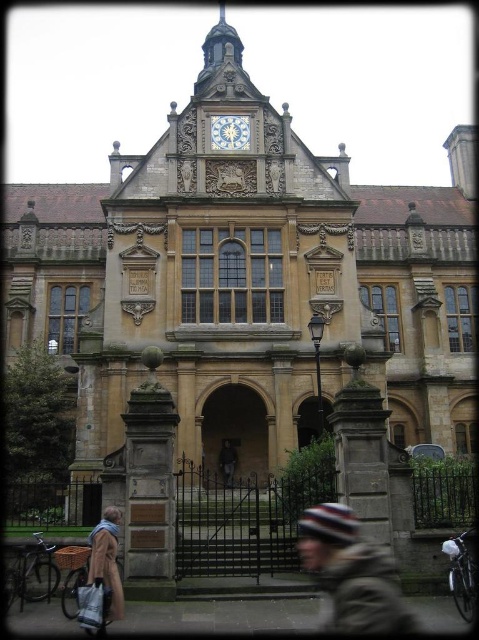
Question: Which point appears farthest from the camera in this image?

Choices:
 (A) (115, 608)
 (B) (211, 147)

Answer: (B)

Question: Does brown woolen hat at center appear under dark brown leather jacket at center?

Choices:
 (A) no
 (B) yes

Answer: (B)

Question: Is brown woolen hat at center to the right of white marble clock at upper center from the viewer's perspective?

Choices:
 (A) no
 (B) yes

Answer: (B)

Question: Does tan wool coat at lower left appear on the right side of dark brown leather jacket at center?

Choices:
 (A) no
 (B) yes

Answer: (A)

Question: Which point is closer to the camera?

Choices:
 (A) dark brown leather jacket at center
 (B) tan wool coat at lower left

Answer: (B)

Question: Estimate the real-world distances between objects in this image. Which object is farther from the white marble clock at upper center?

Choices:
 (A) brown woolen hat at center
 (B) tan wool coat at lower left
 (C) dark brown leather jacket at center

Answer: (B)